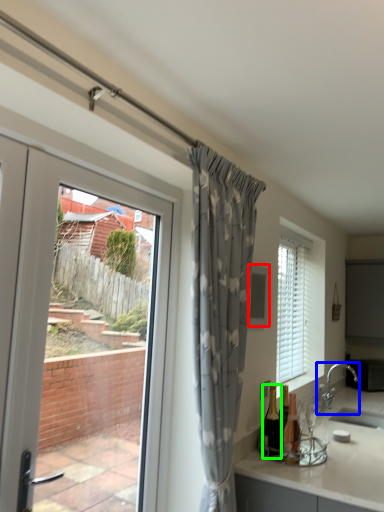
Question: Which object is positioned closest to window screen (highlighted by a red box)? Select from tap (highlighted by a blue box) and bottle (highlighted by a green box).

Choices:
 (A) tap
 (B) bottle

Answer: (B)